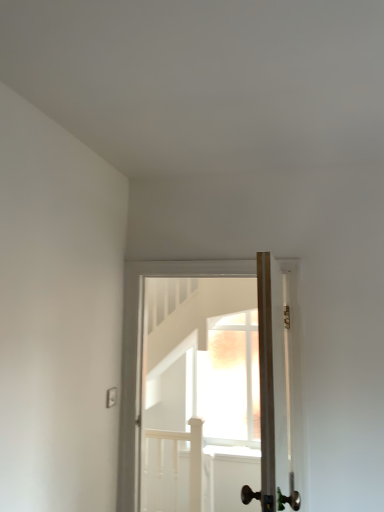
Question: Considering their positions, is wooden door at center, which is the first door from back to front, located in front of or behind wooden door at center, which is counted as the second door, starting from the back?

Choices:
 (A) front
 (B) behind

Answer: (B)

Question: Looking at their shapes, would you say wooden door at center, which is the first door from back to front, is wider or thinner than wooden door at center, which is counted as the second door, starting from the back?

Choices:
 (A) thin
 (B) wide

Answer: (B)

Question: Considering the relative positions of wooden door at center, positioned as the second door in front-to-back order, and wooden door at center, which is counted as the second door, starting from the back, in the image provided, is wooden door at center, positioned as the second door in front-to-back order, to the left or to the right of wooden door at center, which is counted as the second door, starting from the back,?

Choices:
 (A) right
 (B) left

Answer: (B)

Question: Based on their positions, is wooden door at center, which is counted as the second door, starting from the back, located to the left or right of wooden door at center, positioned as the second door in front-to-back order?

Choices:
 (A) left
 (B) right

Answer: (B)

Question: From a real-world perspective, is wooden door at center, which is counted as the second door, starting from the back, physically located above or below wooden door at center, which is the first door from back to front?

Choices:
 (A) below
 (B) above

Answer: (B)

Question: Based on their sizes in the image, would you say wooden door at center, which is counted as the second door, starting from the back, is bigger or smaller than wooden door at center, which is the first door from back to front?

Choices:
 (A) small
 (B) big

Answer: (A)

Question: Is wooden door at center, which is counted as the second door, starting from the back, taller or shorter than wooden door at center, which is the first door from back to front?

Choices:
 (A) tall
 (B) short

Answer: (B)